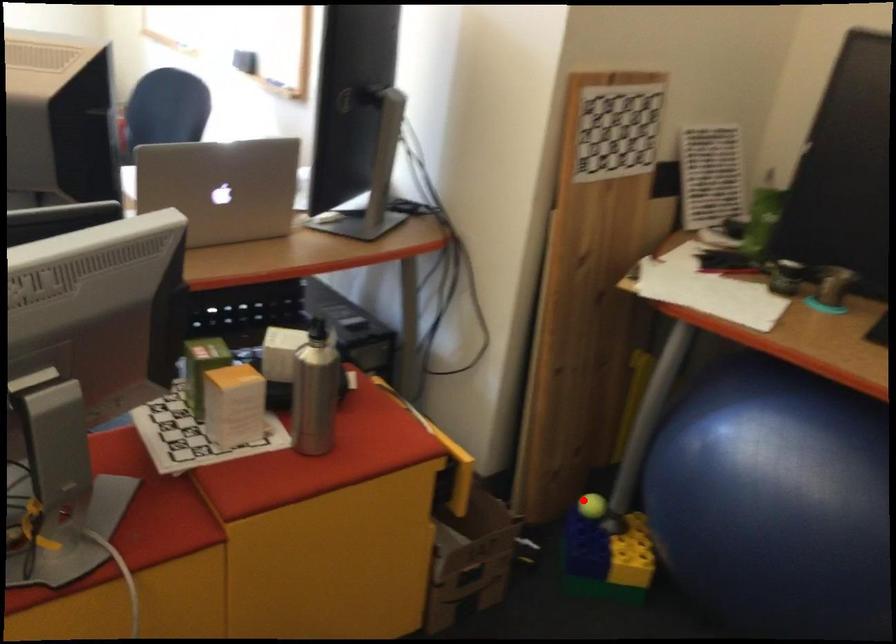
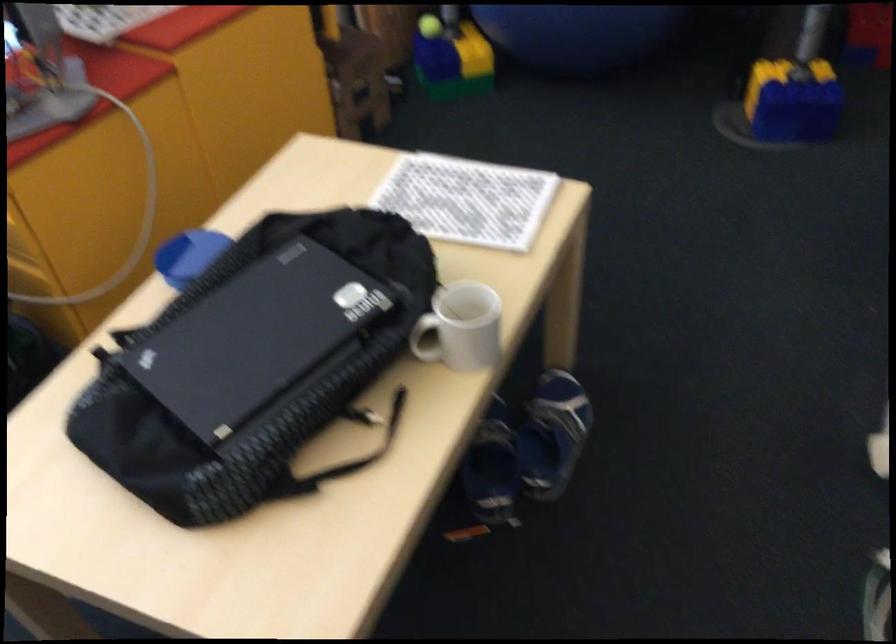
In the second image, find the point that corresponds to the highlighted location in the first image.

(428, 26)